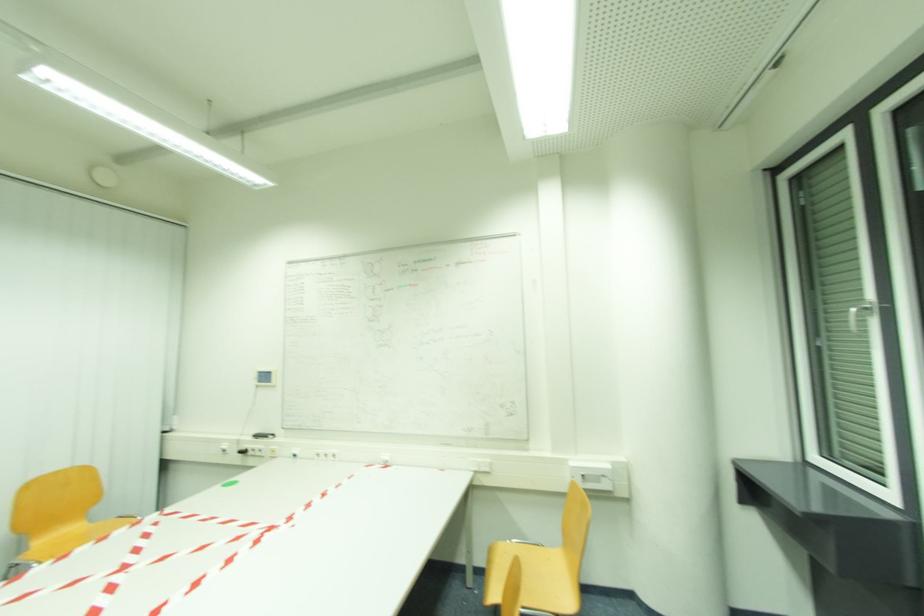
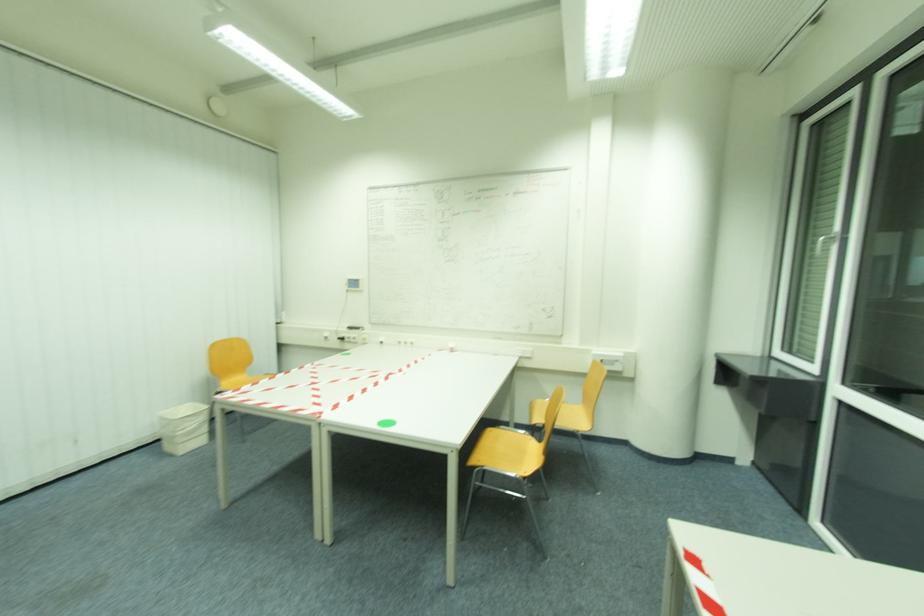
Which direction would the cameraman need to move to produce the second image?

The cameraman moved toward left, backward.